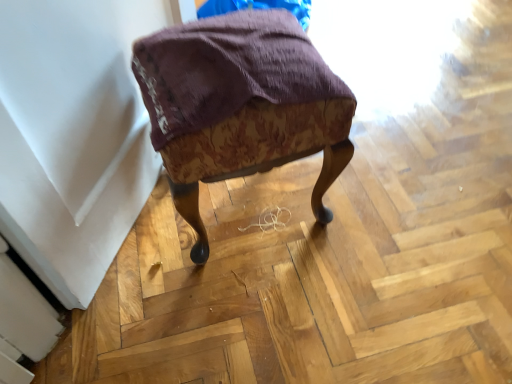
Describe the element at coordinates (240, 105) in the screenshot. I see `patterned fabric stool at center` at that location.

What is the approximate height of patterned fabric stool at center?

The height of patterned fabric stool at center is 18.57 inches.

The width and height of the screenshot is (512, 384). What are the coordinates of `patterned fabric stool at center` in the screenshot? It's located at (240, 105).

Locate an element on the screen. Image resolution: width=512 pixels, height=384 pixels. patterned fabric stool at center is located at coordinates (240, 105).